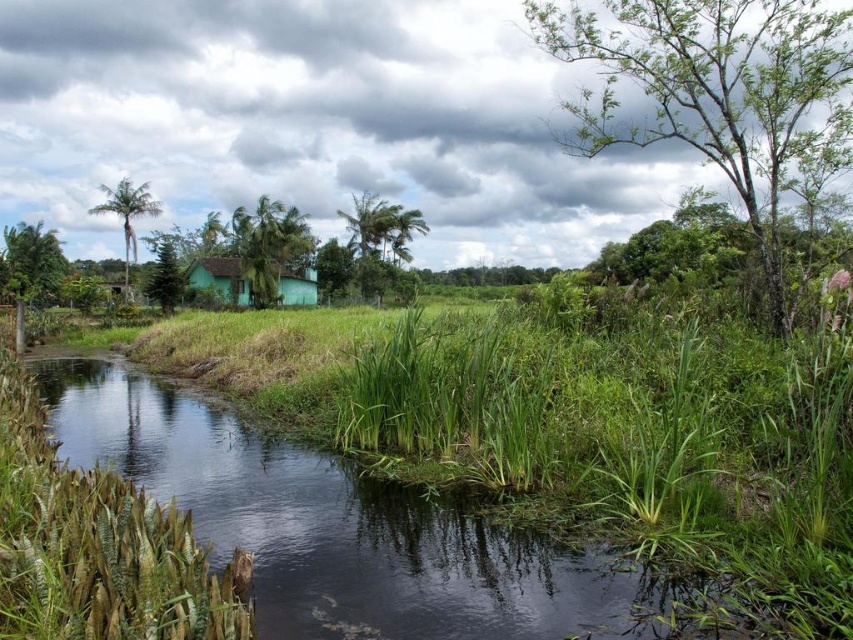
You are standing in the rural landscape and want to take a photo of the green leafy tree at upper right. If your camera has a maximum zoom range of 10 meters, will you be able to capture the tree clearly without moving closer?

The green leafy tree at upper right is 8.38 meters away from the viewer. Since the camera can zoom up to 10 meters, you can capture the tree clearly without moving closer.

You are a bird flying over the rural landscape and want to land on the tallest green leafy tree. Which tree should you choose between the green leafy tree at upper right and the green leafy tree at left?

The green leafy tree at upper right is larger in size compared to the green leafy tree at left, so it is the tallest and you should choose the green leafy tree at upper right to land on.